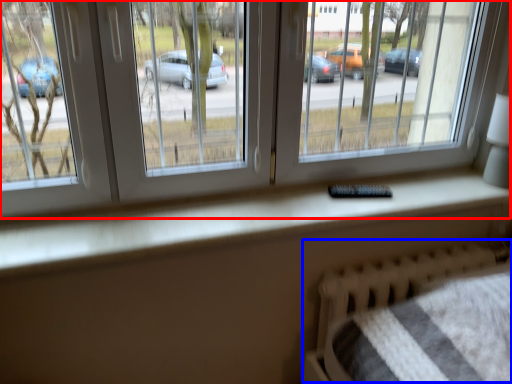
Question: Which object appears farthest to the camera in this image, window (highlighted by a red box) or hospital bed (highlighted by a blue box)?

Choices:
 (A) window
 (B) hospital bed

Answer: (B)